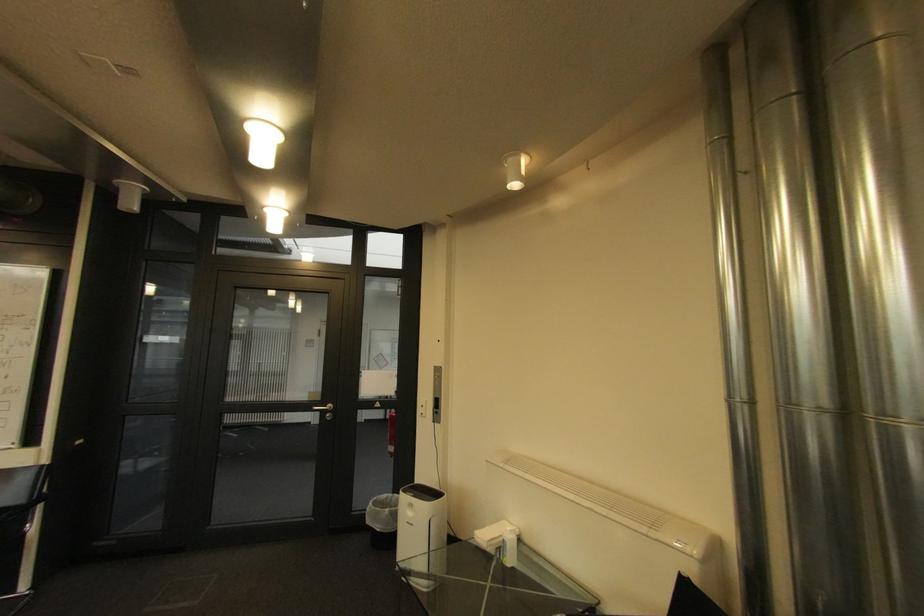
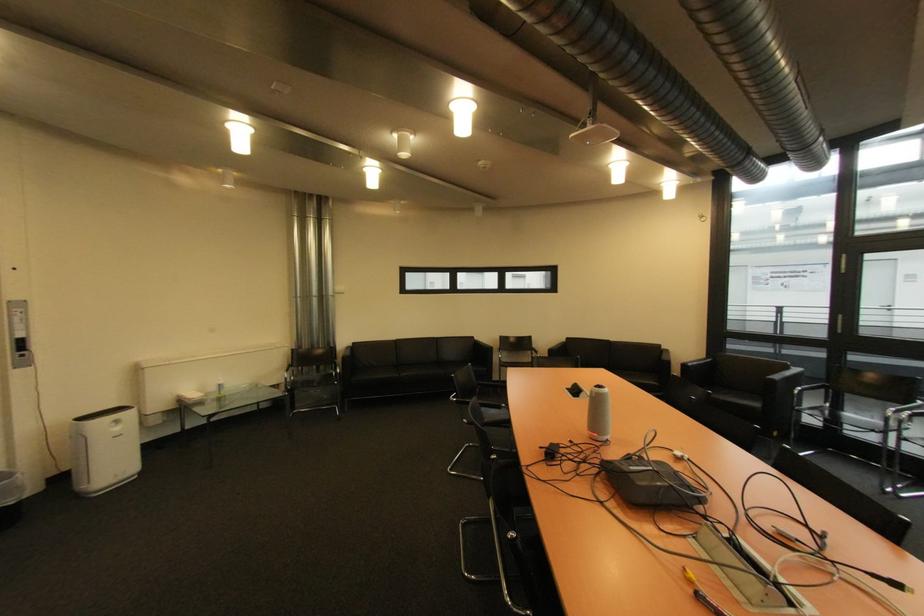
The point at (x=418, y=515) is marked in the first image. Where is the corresponding point in the second image?

(124, 430)